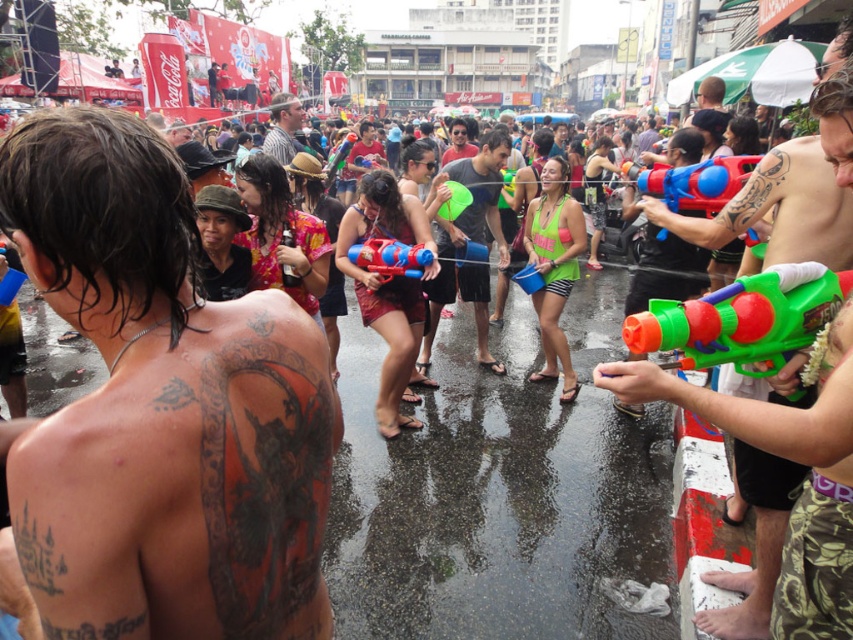
Who is positioned more to the right, matte plastic water gun at upper right or green rubber ball at center?

Positioned to the right is matte plastic water gun at upper right.

Is matte plastic water gun at upper right shorter than green rubber ball at center?

No.

The width and height of the screenshot is (853, 640). What are the coordinates of `matte plastic water gun at upper right` in the screenshot? It's located at (711, 186).

Identify the location of matte plastic water gun at upper right. This screenshot has height=640, width=853. (711, 186).

Does green plastic water gun at center have a lesser height compared to green plastic water gun at right?

No.

Between point (672, 390) and point (747, 300), which one is positioned in front?

Point (672, 390) is more forward.

Where is `green plastic water gun at center`? This screenshot has width=853, height=640. green plastic water gun at center is located at coordinates (793, 461).

In order to click on green plastic water gun at center in this screenshot , I will do `click(793, 461)`.

Between point (273, 147) and point (460, 196), which one is positioned in front?

Positioned in front is point (460, 196).

Locate an element on the screen. Image resolution: width=853 pixels, height=640 pixels. striped fabric hat at center is located at coordinates (283, 125).